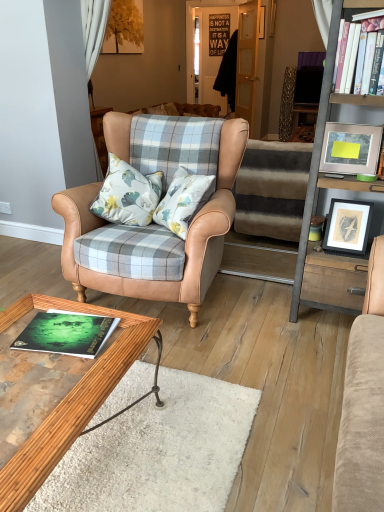
Question: Is white hardcover book at upper right, the first book viewed from the right, a part of wooden framed print at right, the 1th picture frame ordered from the bottom?

Choices:
 (A) yes
 (B) no

Answer: (B)

Question: Is wooden framed print at right, which is counted as the second picture frame, starting from the top, positioned with its back to white hardcover book at upper right, marked as the 2th book in a front-to-back arrangement?

Choices:
 (A) yes
 (B) no

Answer: (B)

Question: Does wooden framed print at right, which is counted as the second picture frame, starting from the top, touch white hardcover book at upper right, positioned as the 2th book in bottom-to-top order?

Choices:
 (A) no
 (B) yes

Answer: (A)

Question: From the image's perspective, is wooden framed print at right, the 1th picture frame ordered from the bottom, below white hardcover book at upper right, which is the 1th book from top to bottom?

Choices:
 (A) no
 (B) yes

Answer: (B)

Question: Considering the relative sizes of wooden framed print at right, which is counted as the second picture frame, starting from the top, and white hardcover book at upper right, marked as the 2th book in a front-to-back arrangement, in the image provided, is wooden framed print at right, which is counted as the second picture frame, starting from the top, shorter than white hardcover book at upper right, marked as the 2th book in a front-to-back arrangement,?

Choices:
 (A) no
 (B) yes

Answer: (A)

Question: Can you confirm if wooden framed print at right, which is counted as the second picture frame, starting from the top, is positioned to the left of white hardcover book at upper right, acting as the first book starting from the back?

Choices:
 (A) yes
 (B) no

Answer: (B)

Question: Does wooden polished coffee table at lower left have a greater width compared to striped carpet at center?

Choices:
 (A) yes
 (B) no

Answer: (B)

Question: Can you confirm if wooden polished coffee table at lower left is positioned to the left of striped carpet at center?

Choices:
 (A) yes
 (B) no

Answer: (A)

Question: Would you say wooden polished coffee table at lower left contains striped carpet at center?

Choices:
 (A) yes
 (B) no

Answer: (B)

Question: From a real-world perspective, is wooden polished coffee table at lower left under striped carpet at center?

Choices:
 (A) no
 (B) yes

Answer: (B)

Question: Is wooden polished coffee table at lower left positioned before striped carpet at center?

Choices:
 (A) no
 (B) yes

Answer: (B)

Question: Does wooden polished coffee table at lower left have a larger size compared to striped carpet at center?

Choices:
 (A) no
 (B) yes

Answer: (A)

Question: From a real-world perspective, is striped carpet at center under wooden polished coffee table at lower left?

Choices:
 (A) no
 (B) yes

Answer: (A)